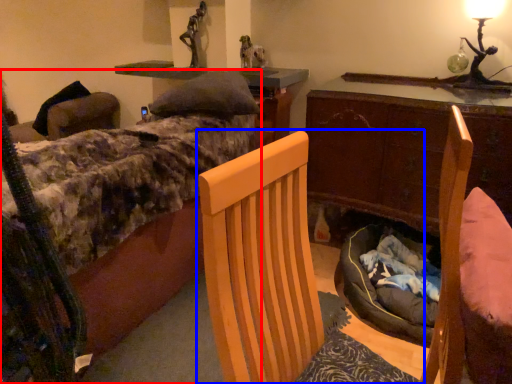
Question: Among these objects, which one is nearest to the camera, bed (highlighted by a red box) or chair (highlighted by a blue box)?

Choices:
 (A) bed
 (B) chair

Answer: (B)